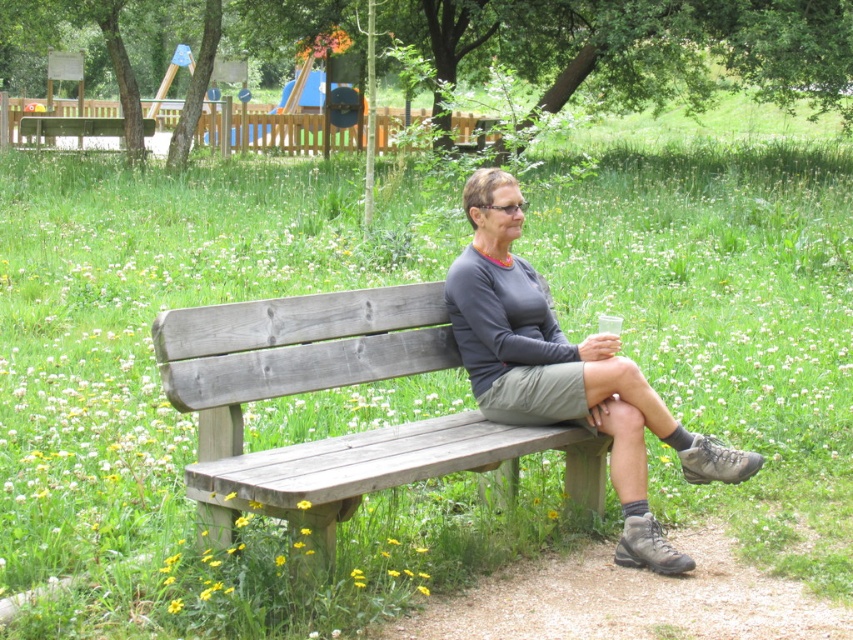
Question: Which object is closer to the camera taking this photo?

Choices:
 (A) matte gray shirt at center
 (B) wooden bench at center
 (C) gray wooden bench at center

Answer: (C)

Question: Is gray wooden bench at center to the left of wooden bench at center from the viewer's perspective?

Choices:
 (A) yes
 (B) no

Answer: (B)

Question: Does gray wooden bench at center appear over wooden bench at center?

Choices:
 (A) yes
 (B) no

Answer: (B)

Question: Which point is farther from the camera taking this photo?

Choices:
 (A) (18, 129)
 (B) (490, 355)

Answer: (A)

Question: Can you confirm if matte gray shirt at center is positioned to the left of wooden bench at center?

Choices:
 (A) no
 (B) yes

Answer: (A)

Question: Estimate the real-world distances between objects in this image. Which object is closer to the wooden bench at center?

Choices:
 (A) gray wooden bench at center
 (B) matte gray shirt at center

Answer: (B)